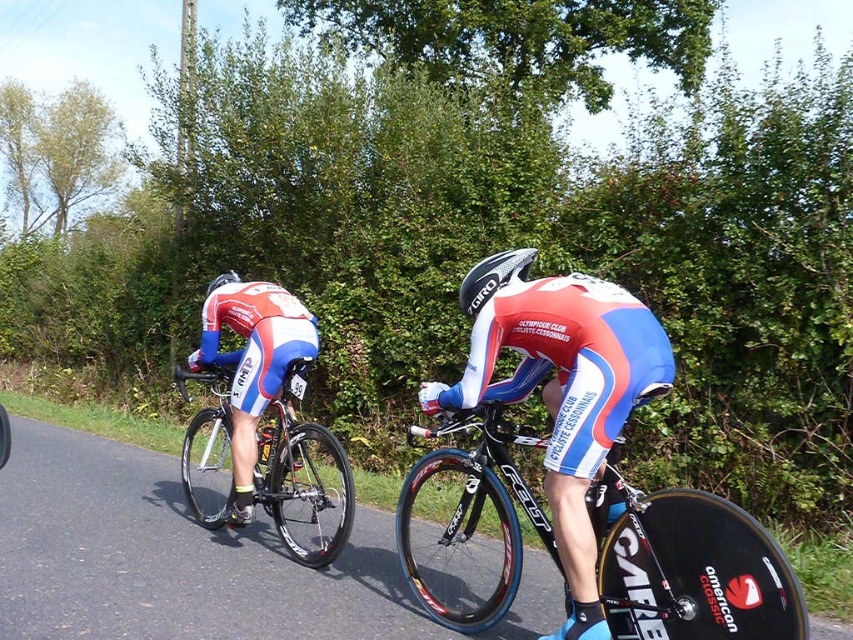
Does shiny black frame at center have a lesser width compared to matte blue and white cycling suit at center?

No.

Is shiny black frame at center shorter than matte blue and white cycling suit at center?

Indeed, shiny black frame at center has a lesser height compared to matte blue and white cycling suit at center.

Between point (535, 508) and point (556, 442), which one is positioned behind?

The point (535, 508) is more distant.

Identify the location of shiny black frame at center. (688, 564).

Is point (606, 444) positioned after point (227, 317)?

No, (606, 444) is in front of (227, 317).

How much distance is there between matte blue and white cycling suit at center and white/blue/red jersey at center?

matte blue and white cycling suit at center and white/blue/red jersey at center are 1.96 meters apart from each other.

Is point (596, 452) closer to camera compared to point (231, 330)?

That is True.

Where is `matte blue and white cycling suit at center`? matte blue and white cycling suit at center is located at coordinates (560, 388).

Which is behind, point (529, 364) or point (485, 291)?

Positioned behind is point (529, 364).

Which of these two, matte blue and white cycling suit at center or glossy carbon fiber bicycle helmet at center, stands shorter?

With less height is glossy carbon fiber bicycle helmet at center.

The height and width of the screenshot is (640, 853). Find the location of `matte blue and white cycling suit at center`. matte blue and white cycling suit at center is located at coordinates click(560, 388).